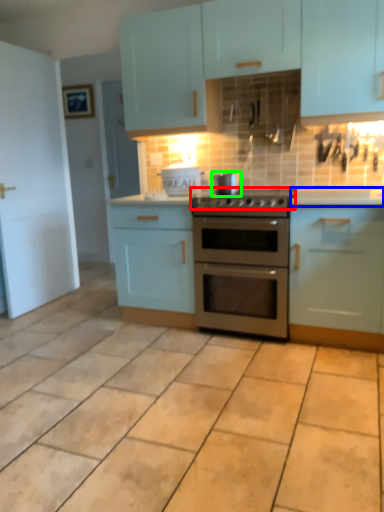
Question: Which object is the closest to the gas stove (highlighted by a red box)? Choose among these: counter top (highlighted by a blue box) or appliance (highlighted by a green box).

Choices:
 (A) counter top
 (B) appliance

Answer: (B)